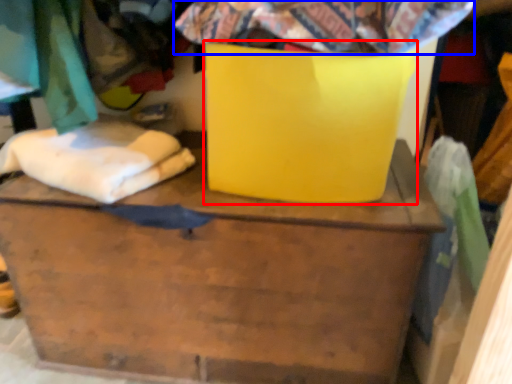
Question: Among these objects, which one is farthest to the camera, cardboard box (highlighted by a red box) or fabric (highlighted by a blue box)?

Choices:
 (A) cardboard box
 (B) fabric

Answer: (A)